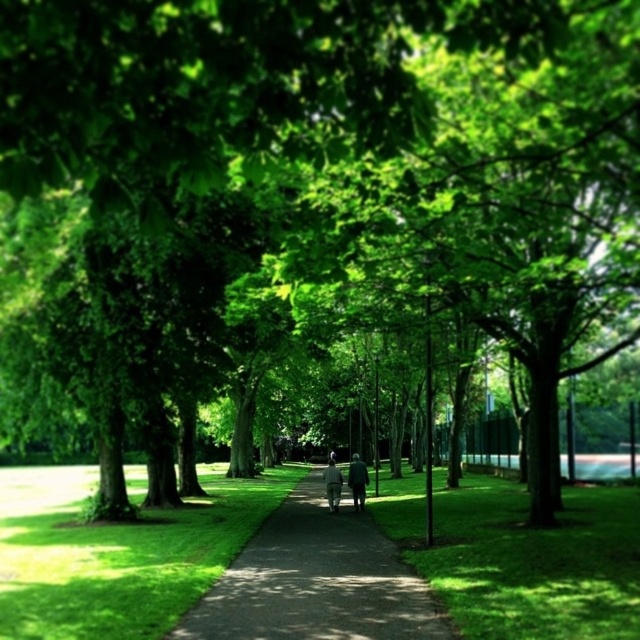
Is dark gray suit at center thinner than white cotton jacket at center?

In fact, dark gray suit at center might be wider than white cotton jacket at center.

Looking at this image, which is more to the right, dark gray suit at center or white cotton jacket at center?

dark gray suit at center

You are a GUI agent. You are given a task and a screenshot of the screen. Output one action in this format:
    pyautogui.click(x=<x>, y=<y>)
    Task: Click on the dark gray suit at center
    
    Given the screenshot: What is the action you would take?
    pyautogui.click(x=356, y=481)

At what (x,y) coordinates should I click in order to perform the action: click on dark gray suit at center. Please return your answer as a coordinate pair (x, y). The image size is (640, 640). Looking at the image, I should click on (356, 481).

Who is taller, green soft grass at center or white cotton jacket at center?

Standing taller between the two is green soft grass at center.

Locate an element on the screen. green soft grass at center is located at coordinates (116, 552).

Does point (80, 518) come behind point (339, 488)?

That is False.

Identify the location of green soft grass at center. Image resolution: width=640 pixels, height=640 pixels. (116, 552).

Who is more distant from viewer, (532, 538) or (352, 458)?

The point (352, 458) is more distant.

In the scene shown: Who is shorter, green grass at center or dark gray suit at center?

With less height is dark gray suit at center.

Image resolution: width=640 pixels, height=640 pixels. I want to click on green grass at center, so 520,557.